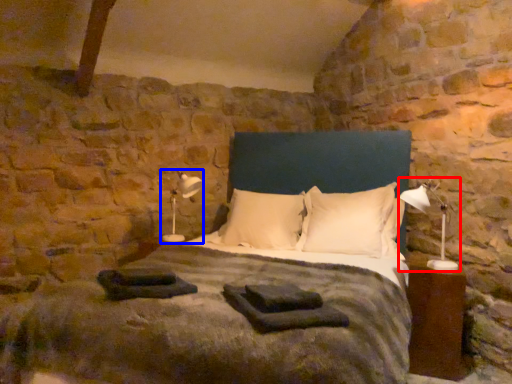
Question: Which object is closer to the camera taking this photo, table lamp (highlighted by a red box) or table lamp (highlighted by a blue box)?

Choices:
 (A) table lamp
 (B) table lamp

Answer: (A)